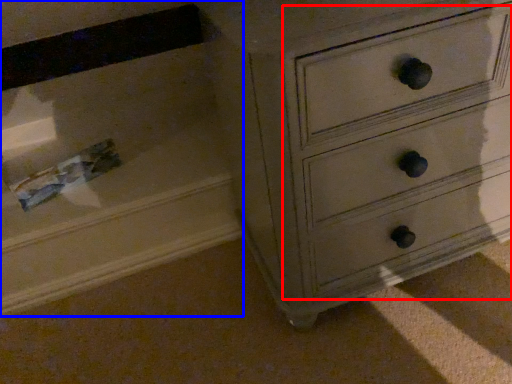
Question: Which of the following is the farthest to the observer, drawer (highlighted by a red box) or drawer (highlighted by a blue box)?

Choices:
 (A) drawer
 (B) drawer

Answer: (B)